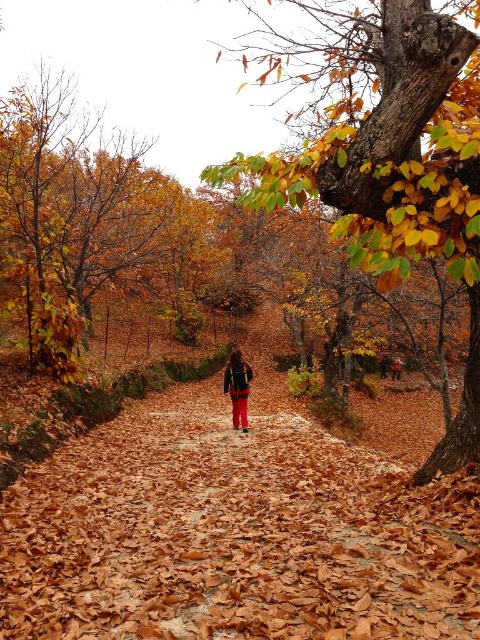
You are standing on the dirt path in the autumn forest and see both the smooth bark tree at center and the matte black backpack at center. Which object is nearer to you?

The smooth bark tree at center is closer to the viewer than the matte black backpack at center, so the smooth bark tree at center is nearer.

You are hiking along the dirt path and notice a smooth bark tree at center and a matte black backpack at center. Which object is located higher up in the image?

The smooth bark tree at center is positioned over the matte black backpack at center, so it is higher up in the image.

You are hiking along the dirt path and notice a matte black backpack at center. Is the brown leafy path at center located above or below the backpack?

The brown leafy path at center is below the matte black backpack at center, so it is located below the backpack.